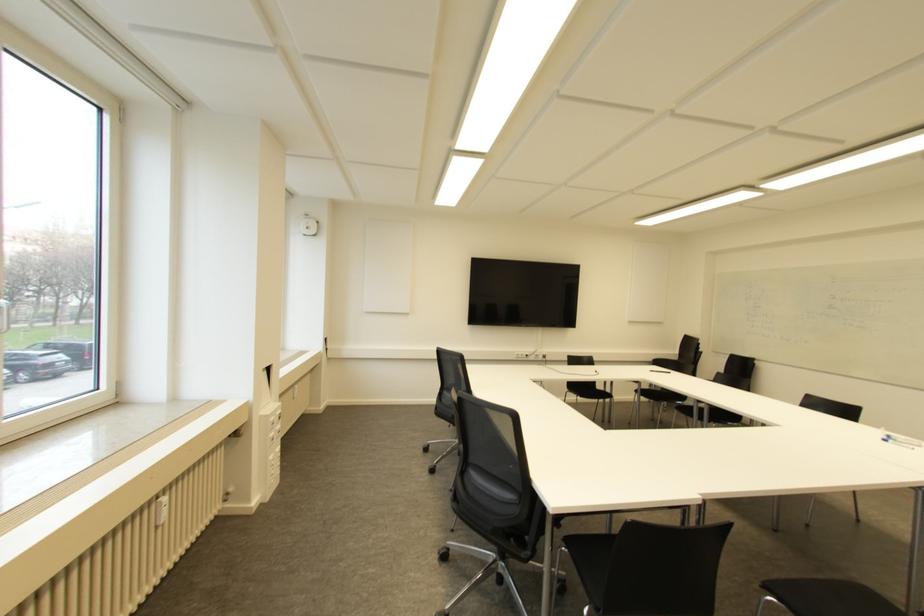
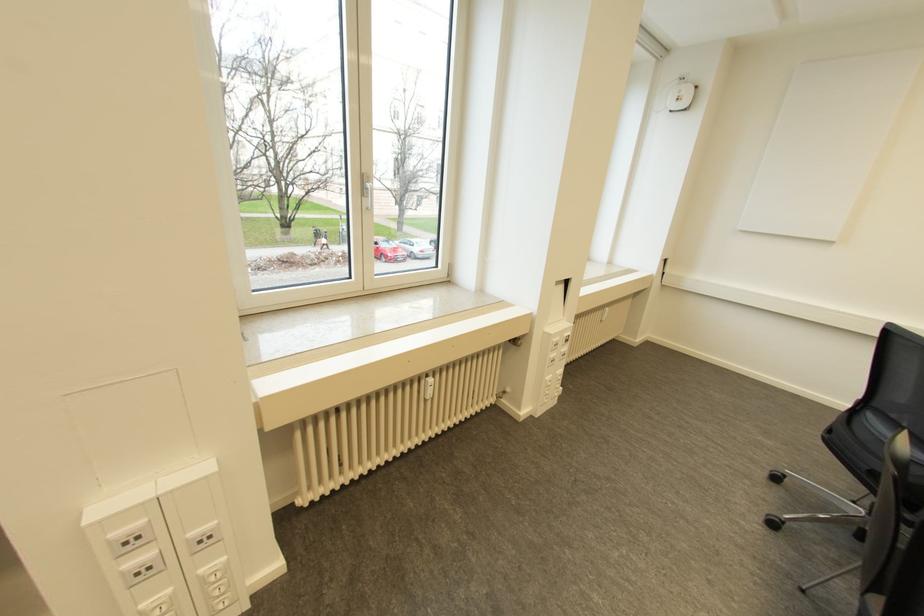
The first image is from the beginning of the video and the second image is from the end. How did the camera likely rotate when shooting the video?

The rotation direction of the camera is left-down.